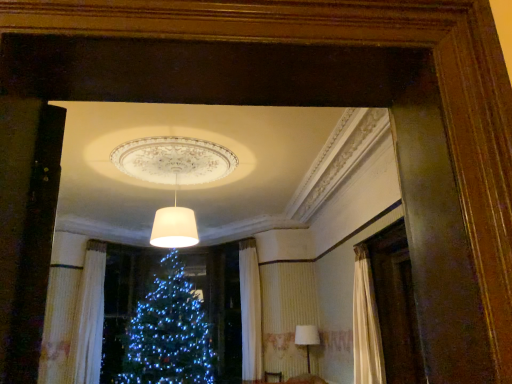
Question: In which direction should I rotate to look at white matte lampshade at center, acting as the first lamp starting from the left?

Choices:
 (A) left
 (B) right

Answer: (A)

Question: From a real-world perspective, is white textured curtain at lower left positioned under white matte lampshade at center, which is the first lamp in front-to-back order, based on gravity?

Choices:
 (A) yes
 (B) no

Answer: (A)

Question: Is white textured curtain at lower left beside white matte lampshade at center, arranged as the second lamp when ordered from the bottom?

Choices:
 (A) no
 (B) yes

Answer: (A)

Question: Is white textured curtain at lower left positioned beyond the bounds of white matte lampshade at center, the first lamp positioned from the top?

Choices:
 (A) no
 (B) yes

Answer: (B)

Question: Can you confirm if white textured curtain at lower left is thinner than white matte lampshade at center, which appears as the second lamp when viewed from the back?

Choices:
 (A) yes
 (B) no

Answer: (A)

Question: Considering the relative sizes of white textured curtain at lower left and white matte lampshade at center, the 2th lamp positioned from the right, in the image provided, is white textured curtain at lower left wider than white matte lampshade at center, the 2th lamp positioned from the right,?

Choices:
 (A) yes
 (B) no

Answer: (B)

Question: Is the position of white textured curtain at lower left more distant than that of white matte lampshade at center, the first lamp positioned from the top?

Choices:
 (A) no
 (B) yes

Answer: (B)

Question: Does white matte lampshade at center, the first lamp positioned from the top, turn towards white fabric lampshade at lower right, the second lamp positioned from the front?

Choices:
 (A) yes
 (B) no

Answer: (B)

Question: Can you see white matte lampshade at center, the first lamp positioned from the top, touching white fabric lampshade at lower right, placed as the first lamp when sorted from right to left?

Choices:
 (A) no
 (B) yes

Answer: (A)

Question: Can you confirm if white matte lampshade at center, acting as the first lamp starting from the left, is taller than white fabric lampshade at lower right, the second lamp from the top?

Choices:
 (A) yes
 (B) no

Answer: (B)

Question: From the image's perspective, would you say white matte lampshade at center, arranged as the second lamp when ordered from the bottom, is shown under white fabric lampshade at lower right, the second lamp from the top?

Choices:
 (A) no
 (B) yes

Answer: (A)

Question: Is white matte lampshade at center, the 2th lamp positioned from the right, bigger than white fabric lampshade at lower right, the second lamp positioned from the front?

Choices:
 (A) no
 (B) yes

Answer: (B)

Question: Is white matte lampshade at center, which appears as the second lamp when viewed from the back, shorter than white fabric lampshade at lower right, arranged as the 1th lamp when viewed from the back?

Choices:
 (A) yes
 (B) no

Answer: (A)

Question: From the image's perspective, does white fabric lampshade at lower right, the 1th lamp in the bottom-to-top sequence, appear lower than white textured curtain at lower left?

Choices:
 (A) yes
 (B) no

Answer: (A)